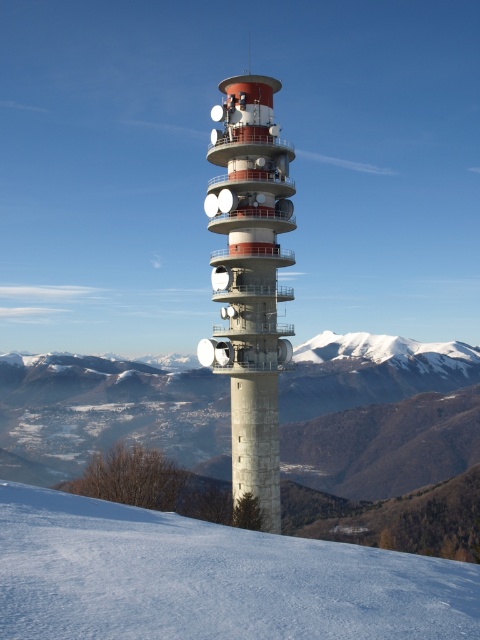
You are standing at the base of the concrete tower at center and want to walk to the white snow at lower center. In which direction should you move relative to the tower?

You should move to the right of the concrete tower at center to reach the white snow at lower center, as it is located to the right of the tower.

You are an engineer inspecting the tower. From your vantage point, which area takes up more space in the image, the white snow at lower center or the concrete tower at center?

The concrete tower at center occupies more space than the white snow at lower center according to the description.

You are planning to build a small shed on the snowy area at lower center. The shed requires a space that is wider than the concrete tower at center. Can the white snow at lower center accommodate the shed?

The white snow at lower center has a width larger than the concrete tower at center, so it can accommodate the shed that requires a space wider than the tower.